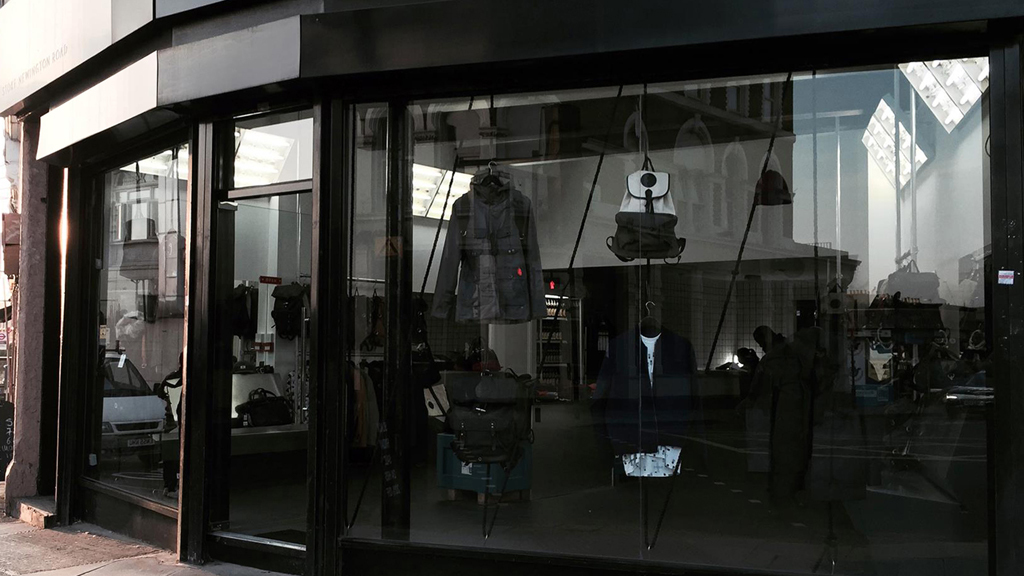
Where is `glass`? glass is located at coordinates (516, 460).